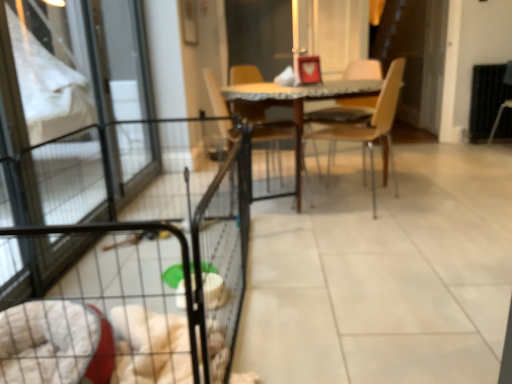
Question: Is wooden table at center completely or partially inside black wire cage at lower left?

Choices:
 (A) no
 (B) yes

Answer: (A)

Question: Is black wire cage at lower left thinner than wooden table at center?

Choices:
 (A) no
 (B) yes

Answer: (B)

Question: Does black wire cage at lower left appear on the left side of wooden table at center?

Choices:
 (A) no
 (B) yes

Answer: (B)

Question: From the image's perspective, is black wire cage at lower left located beneath wooden table at center?

Choices:
 (A) no
 (B) yes

Answer: (B)

Question: Would you consider black wire cage at lower left to be distant from wooden table at center?

Choices:
 (A) yes
 (B) no

Answer: (A)

Question: From a real-world perspective, relative to wooden table at center, is dark brown leather armchair at right vertically above or below?

Choices:
 (A) below
 (B) above

Answer: (A)

Question: Looking at their shapes, would you say dark brown leather armchair at right is wider or thinner than wooden table at center?

Choices:
 (A) wide
 (B) thin

Answer: (B)

Question: Considering the positions of dark brown leather armchair at right and wooden table at center in the image, is dark brown leather armchair at right taller or shorter than wooden table at center?

Choices:
 (A) tall
 (B) short

Answer: (A)

Question: From the image's perspective, is dark brown leather armchair at right positioned above or below wooden table at center?

Choices:
 (A) below
 (B) above

Answer: (B)

Question: Is wooden chair at center, which appears as the 2th chair when viewed from the left, bigger or smaller than wooden chair at center, which is counted as the 1th chair, starting from the left?

Choices:
 (A) small
 (B) big

Answer: (A)

Question: Does point (382, 132) appear closer or farther from the camera than point (258, 132)?

Choices:
 (A) closer
 (B) farther

Answer: (B)

Question: Is wooden chair at center, the first chair from the right, wider or thinner than wooden chair at center, the 2th chair in the right-to-left sequence?

Choices:
 (A) wide
 (B) thin

Answer: (B)

Question: From the image's perspective, is wooden chair at center, the first chair from the right, above or below wooden chair at center, the 2th chair in the right-to-left sequence?

Choices:
 (A) below
 (B) above

Answer: (B)

Question: From a real-world perspective, is clear glass screen door at left physically located above or below wooden chair at center, which is counted as the 1th chair, starting from the left?

Choices:
 (A) above
 (B) below

Answer: (A)

Question: Does point (44, 119) appear closer or farther from the camera than point (211, 102)?

Choices:
 (A) closer
 (B) farther

Answer: (A)